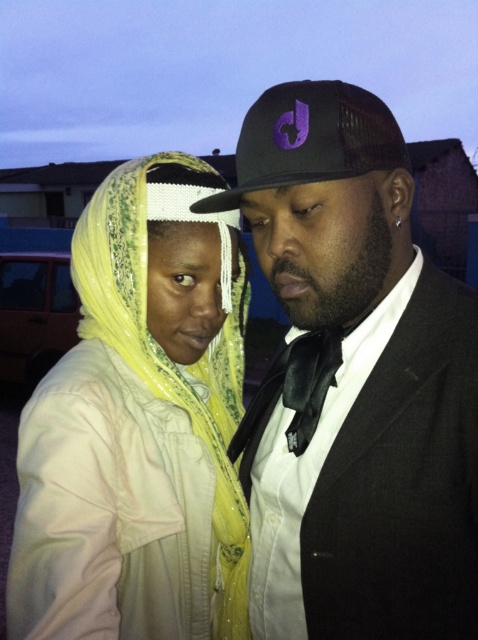
You are a photographer trying to capture a portrait of the two people in the scene. You want to ensure that the focus is on the individual on the right wearing the dark suit. Given that the camera is focused at point (437,460), which is 31.00 inches away from the camera, will the person in the dark suit be in focus?

The distance of point (437,460) from the camera is 31.00 inches. If the person in the dark suit is positioned at or near this point, they would be in focus. However, without knowing their exact distance, it is uncertain. The photographer should adjust the focus point to ensure it aligns with the subject.

Looking at this image, you are a photographer trying to capture a clear shot of both the yellow fabric headscarf at left and the black mesh baseball cap at center. Based on their positions, will you need to adjust your camera focus to ensure both are in focus?

The yellow fabric headscarf at left is below the black mesh baseball cap at center, so they are at different heights. To ensure both are in focus, you should adjust the camera focus to account for their vertical separation.